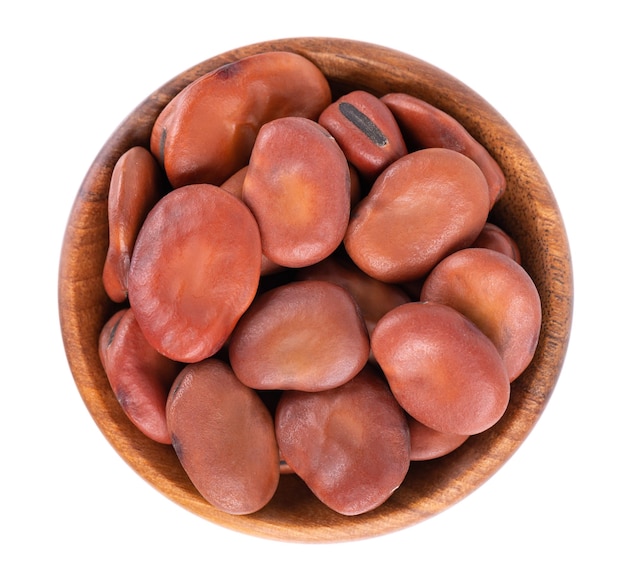
At what (x,y) coordinates should I click in order to perform the action: click on bowl. Please return your answer as a coordinate pair (x, y). Looking at the image, I should click on (434, 479).